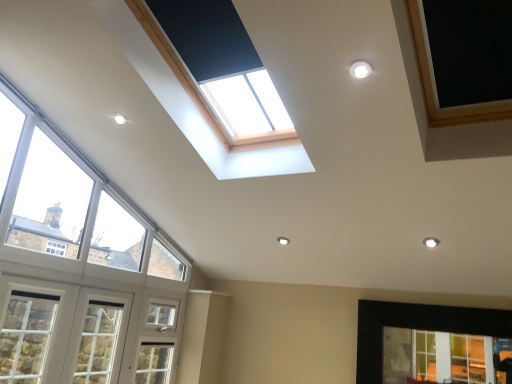
Question: Can you confirm if white wood window at lower left, arranged as the 2th window when viewed from the left, is shorter than white painted wood window at lower left, positioned as the 1th window in left-to-right order?

Choices:
 (A) yes
 (B) no

Answer: (B)

Question: Considering the relative positions of white wood window at lower left, arranged as the 2th window when viewed from the left, and white painted wood window at lower left, positioned as the 1th window in left-to-right order, in the image provided, is white wood window at lower left, arranged as the 2th window when viewed from the left, in front of white painted wood window at lower left, positioned as the 1th window in left-to-right order,?

Choices:
 (A) no
 (B) yes

Answer: (B)

Question: From the image's perspective, does white wood window at lower left, arranged as the 2th window when viewed from the left, appear higher than white painted wood window at lower left, placed as the fourth window when sorted from right to left?

Choices:
 (A) yes
 (B) no

Answer: (B)

Question: Can you confirm if white wood window at lower left, arranged as the 2th window when viewed from the left, is positioned to the right of white painted wood window at lower left, positioned as the 1th window in left-to-right order?

Choices:
 (A) yes
 (B) no

Answer: (A)

Question: From the image's perspective, is white wood window at lower left, arranged as the third window when viewed from the right, located beneath white painted wood window at lower left, placed as the fourth window when sorted from right to left?

Choices:
 (A) no
 (B) yes

Answer: (B)

Question: Does white wood window at lower left, arranged as the third window when viewed from the right, have a larger size compared to white painted wood window at lower left, placed as the fourth window when sorted from right to left?

Choices:
 (A) no
 (B) yes

Answer: (B)

Question: Can you confirm if clear glass window at left, placed as the third window when sorted from left to right, is positioned to the left of white wood window at lower left, arranged as the third window when viewed from the right?

Choices:
 (A) no
 (B) yes

Answer: (A)

Question: Does clear glass window at left, placed as the third window when sorted from left to right, contain white wood window at lower left, arranged as the third window when viewed from the right?

Choices:
 (A) yes
 (B) no

Answer: (B)

Question: Is clear glass window at left, placed as the third window when sorted from left to right, aimed at white wood window at lower left, arranged as the 2th window when viewed from the left?

Choices:
 (A) yes
 (B) no

Answer: (B)

Question: Can you confirm if clear glass window at left, which is the 2th window from right to left, is smaller than white wood window at lower left, arranged as the third window when viewed from the right?

Choices:
 (A) no
 (B) yes

Answer: (A)

Question: Is clear glass window at left, placed as the third window when sorted from left to right, completely or partially outside of white wood window at lower left, arranged as the 2th window when viewed from the left?

Choices:
 (A) no
 (B) yes

Answer: (B)

Question: Can you confirm if clear glass window at left, which is the 2th window from right to left, is taller than white wood window at lower left, arranged as the 2th window when viewed from the left?

Choices:
 (A) yes
 (B) no

Answer: (A)

Question: Is the depth of clear glass window at lower right, the 1th window positioned from the right, greater than that of white painted wood window at lower left, positioned as the 1th window in left-to-right order?

Choices:
 (A) yes
 (B) no

Answer: (A)